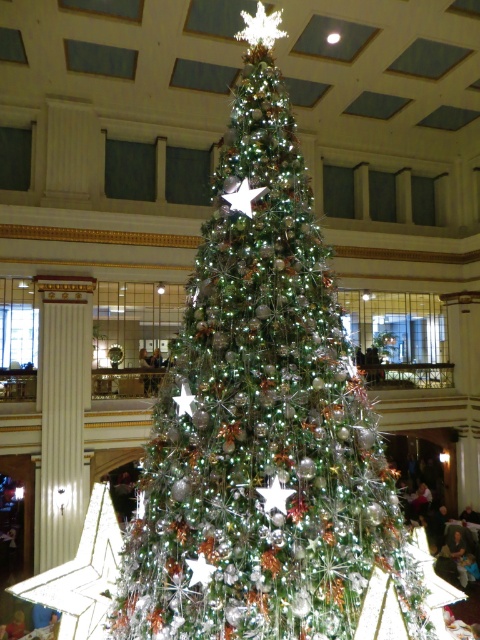
You are a maintenance worker checking the Christmas tree decorations. You need to ensure the metallic silver star at center is securely attached to the iridescent metallic christmas tree at center. Given that the recommended safety distance between the star and the tree top is no more than 10 centimeters, is the current distance within the safety guidelines?

The distance between the iridescent metallic christmas tree at center and the metallic silver star at center is 87.57 centimeters, which exceeds the recommended safety guideline of 10 centimeters. Therefore, the metallic silver star at center is not within the required safety distance and needs adjustment.

You are a guest at the event and want to take a photo of the metallic silver star at center without the iridescent metallic christmas tree at center blocking the view. Is this possible given their sizes?

The iridescent metallic christmas tree at center is larger than the metallic silver star at center, so it might block the view. However, since the star is at the top of the tree, you could position yourself below the tree to capture the star without the tree obstructing it.

You are standing in front of the grand Christmas tree and want to place a new decoration. You have two points marked on the tree where you can hang it. The first point is at coordinate point (319,522) and the second is at point (241,189). Which point is closer to you so you can easily reach it?

Point (319,522) is closer to the viewer than point (241,189), so you can easily reach it.